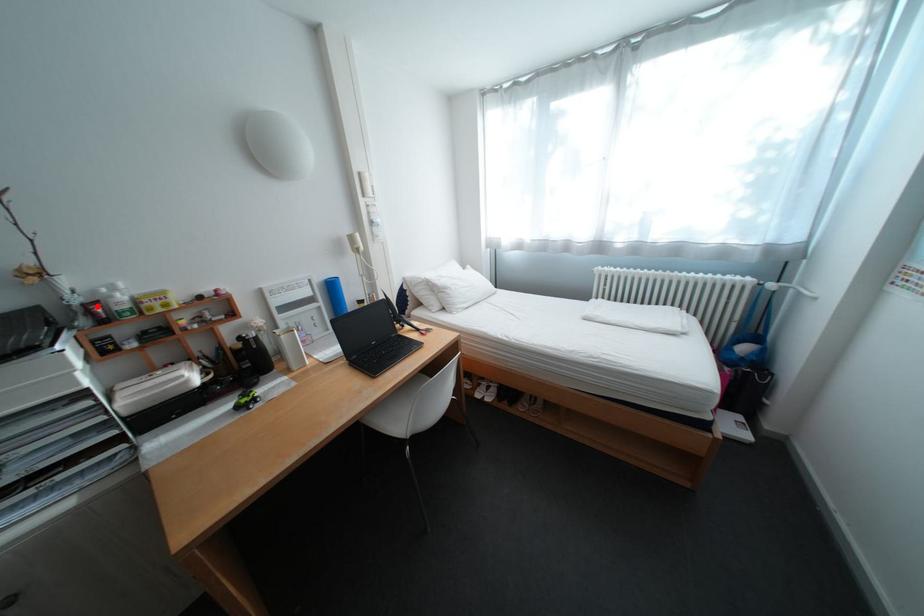
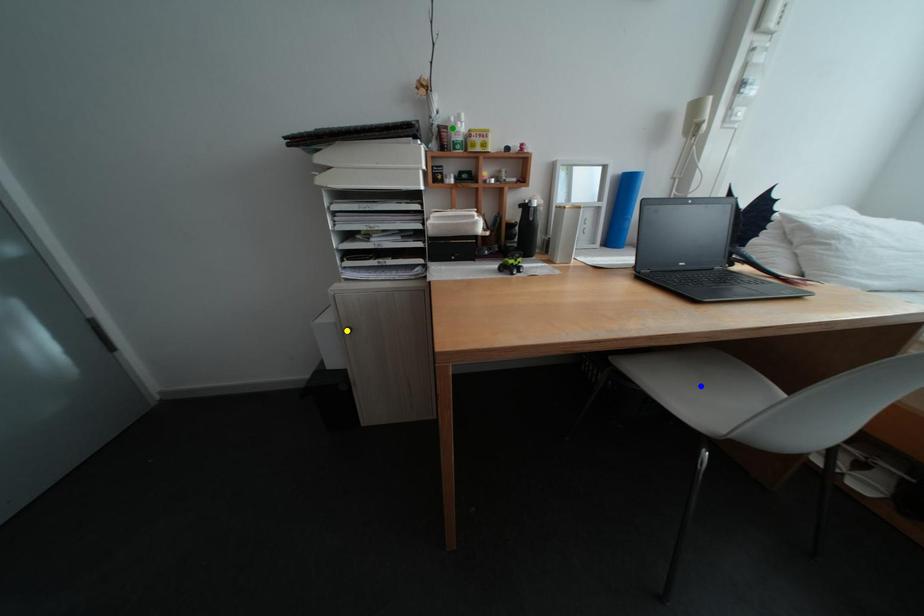
Question: I am providing you with two images of the same scene from different viewpoints. A red point is marked on the first image. You are given multiple points on the second image. Which point in image 2 represents the same 3d spot as the red point in image 1?

Choices:
 (A) green point
 (B) yellow point
 (C) blue point

Answer: (A)